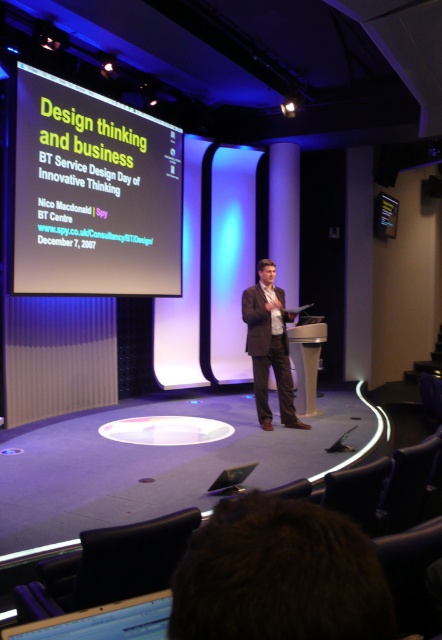
You are a photographer standing at the camera position. You need to adjust your equipment to capture a clear image of the matte white projector screen at upper left. Considering the distance between you and the screen, what is the minimum focal length required for your lens to focus on the screen clearly?

The minimum focal length required for the lens to focus on the matte white projector screen at upper left clearly is 4.89 meters, as the distance between the camera and the screen is 4.89 meters.

You are an attendee at the presentation. You need to locate the brown leather jacket at center and the matte white projector screen at upper left. Which object is positioned higher on the stage?

The matte white projector screen at upper left is positioned higher on the stage than the brown leather jacket at center.

You are an attendee sitting in the front row of the conference hall. You notice the matte white projector screen at upper left and the brown leather jacket at center. Which object is positioned closer to you?

The matte white projector screen at upper left is closer to the viewer than the brown leather jacket at center.